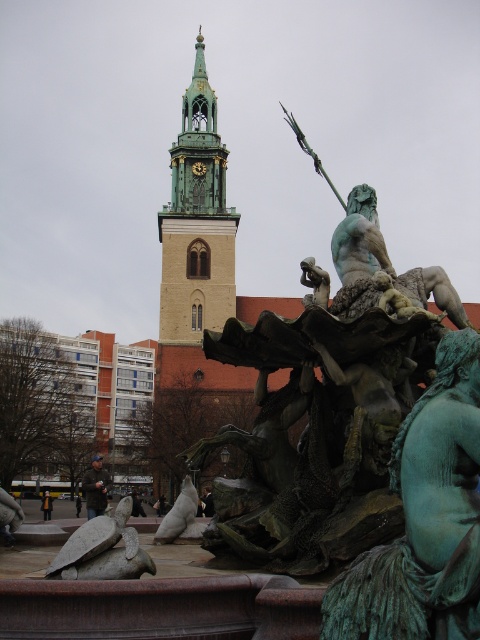
Does green patina statue at center come in front of bronze statue at lower left?

Yes, green patina statue at center is closer to the viewer.

Who is positioned more to the right, green patina statue at center or bronze statue at lower left?

green patina statue at center is more to the right.

Between point (384, 596) and point (118, 538), which one is positioned behind?

Positioned behind is point (118, 538).

The image size is (480, 640). I want to click on green patina statue at center, so click(x=424, y=518).

Can you confirm if green patina statue at center is bigger than bronze statue at center?

No, green patina statue at center is not bigger than bronze statue at center.

Is green patina statue at center behind bronze statue at center?

No, green patina statue at center is in front of bronze statue at center.

Is point (407, 492) closer to viewer compared to point (172, 534)?

Yes, it is in front of point (172, 534).

This screenshot has height=640, width=480. In order to click on green patina statue at center in this screenshot , I will do `click(424, 518)`.

Can you confirm if green copper bell tower at upper center is thinner than bronze statue at center?

No, green copper bell tower at upper center is not thinner than bronze statue at center.

Can you confirm if green copper bell tower at upper center is positioned to the right of bronze statue at center?

In fact, green copper bell tower at upper center is to the left of bronze statue at center.

The image size is (480, 640). What do you see at coordinates (196, 221) in the screenshot? I see `green copper bell tower at upper center` at bounding box center [196, 221].

This screenshot has height=640, width=480. I want to click on green copper bell tower at upper center, so click(196, 221).